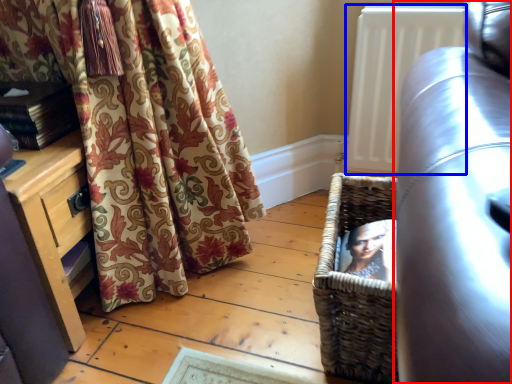
Question: Which object is closer to the camera taking this photo, studio couch (highlighted by a red box) or radiator (highlighted by a blue box)?

Choices:
 (A) studio couch
 (B) radiator

Answer: (A)